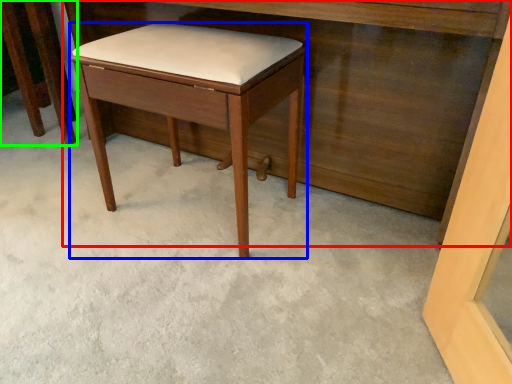
Question: Based on their relative distances, which object is farther from vanity (highlighted by a red box)? Choose from stool (highlighted by a blue box) and furniture (highlighted by a green box).

Choices:
 (A) stool
 (B) furniture

Answer: (B)